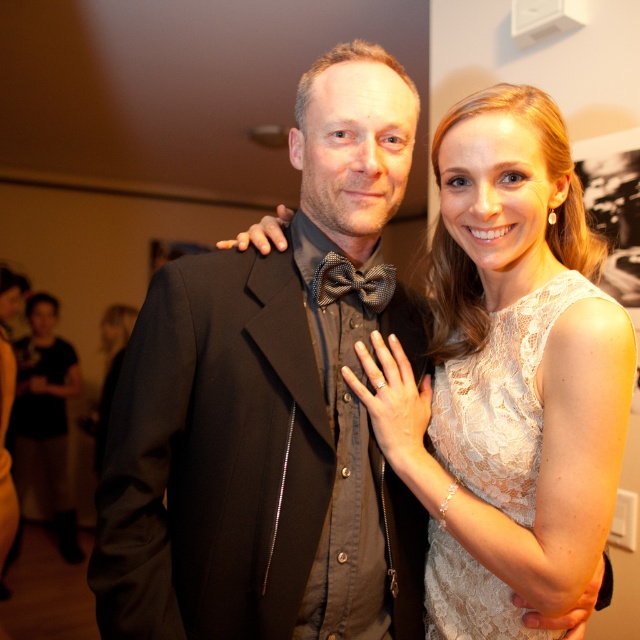
Question: Can you confirm if white lace dress at center is thinner than plaid fabric bow tie at center?

Choices:
 (A) no
 (B) yes

Answer: (A)

Question: Which point appears closest to the camera in this image?

Choices:
 (A) click(330, 403)
 (B) click(336, 273)
 (C) click(520, 204)

Answer: (C)

Question: Can you confirm if white lace dress at center is positioned below lace fabric dress at right?

Choices:
 (A) yes
 (B) no

Answer: (B)

Question: Can you confirm if black matte suit at center is positioned below plaid fabric bow tie at center?

Choices:
 (A) no
 (B) yes

Answer: (B)

Question: Which point is closer to the camera taking this photo?

Choices:
 (A) (385, 273)
 (B) (545, 291)
 (C) (456, 170)
 (D) (346, 390)

Answer: (B)

Question: Among these objects, which one is farthest from the camera?

Choices:
 (A) plaid fabric bow tie at center
 (B) lace fabric dress at right
 (C) white lace dress at center

Answer: (A)